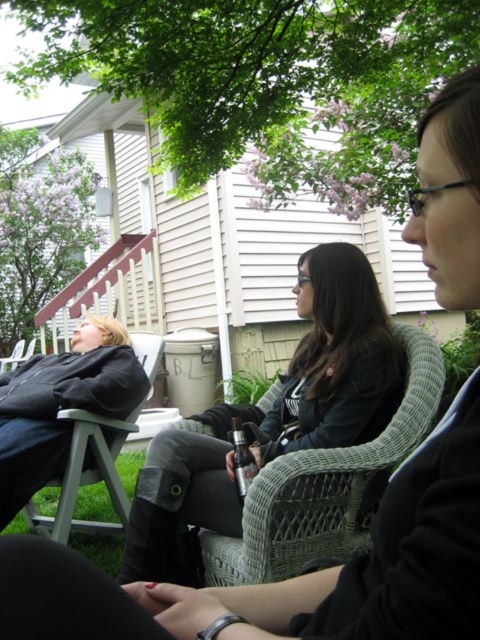
Question: Is woven wicker chair at center to the right of matte black chair at left from the viewer's perspective?

Choices:
 (A) yes
 (B) no

Answer: (A)

Question: Can you confirm if woven wicker chair at center is smaller than matte black chair at left?

Choices:
 (A) no
 (B) yes

Answer: (B)

Question: Among these objects, which one is nearest to the camera?

Choices:
 (A) woven wicker chair at center
 (B) wooden porch at upper left

Answer: (A)

Question: Which point is closer to the camera?

Choices:
 (A) wooden porch at upper left
 (B) woven wicker chair at center
 (C) matte black chair at left

Answer: (B)

Question: Does woven wicker chair at center have a larger size compared to wooden porch at upper left?

Choices:
 (A) yes
 (B) no

Answer: (B)

Question: Which object is closer to the camera taking this photo?

Choices:
 (A) wooden porch at upper left
 (B) matte black chair at left

Answer: (B)